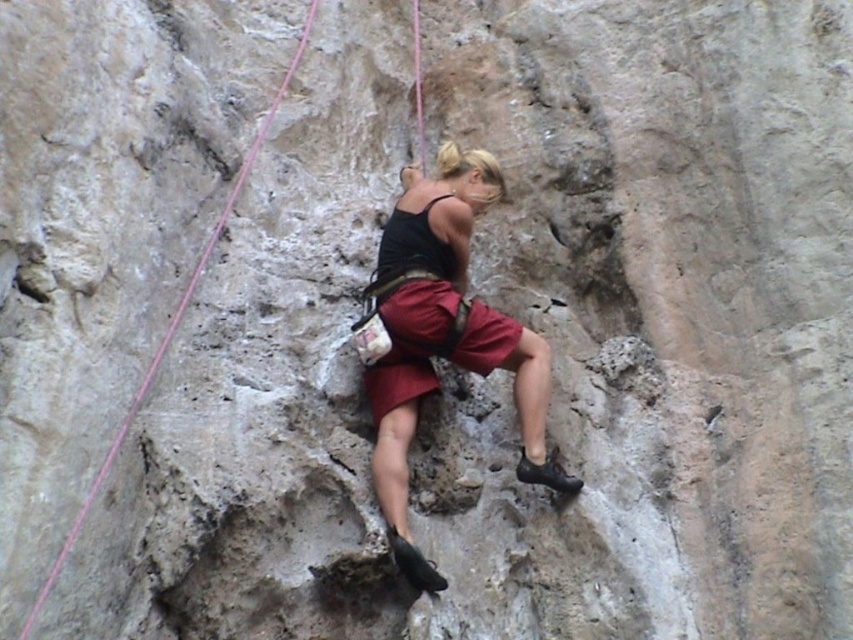
From the picture: You are a photographer taking a picture of the climber. You want to ensure the matte black tank top at center and the matte red shorts at center are both visible in the frame. Based on their positions, which clothing item should you focus on first to ensure both are in focus?

The matte black tank top at center is located above the matte red shorts at center. To ensure both are in focus, focus on the matte black tank top at center first since it is closer to the camera, and the shorts will naturally fall into the depth of field.

Based on the scene of a climber on a rock face, can you determine if the matte black tank top at center is wider than the matte red shorts at center?

The matte black tank top at center might be wider than matte red shorts at center according to the description.

You are a rock climbing instructor assessing a climber who is at point (399,250). The climber is 5 feet tall. Can they safely reach the next hold 10 feet above their current position?

The distance of point (399,250) from the viewer is 104.41 feet. Since the climber is only 5 feet tall and the next hold is 10 feet above them, they would need to extend their arms to reach it. However, the vertical distance between the climber and the hold is 10 feet, which may be challenging depending on their arm length and the angle of the rock face. The instructor should advise the climber to look for closer holds or use their legs to push upward for better leverage.